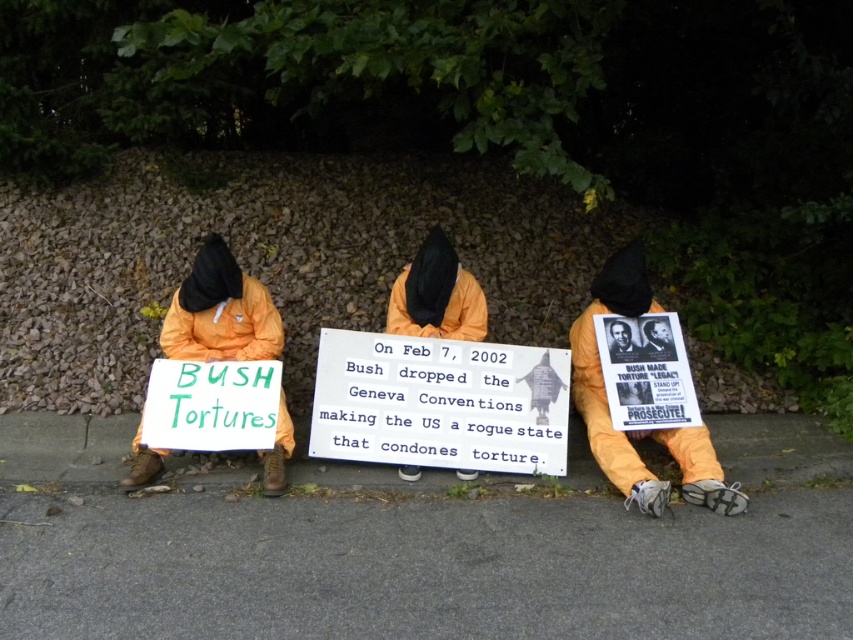
Does orange fabric poster at center have a greater height compared to orange fabric sign at left?

Yes.

Is orange fabric poster at center further to camera compared to orange fabric sign at left?

That is False.

Is point (642, 477) more distant than point (270, 349)?

No, (642, 477) is closer to viewer.

At what (x,y) coordinates should I click in order to perform the action: click on orange fabric poster at center. Please return your answer as a coordinate pair (x, y). Image resolution: width=853 pixels, height=640 pixels. Looking at the image, I should click on pyautogui.click(x=637, y=429).

Which is in front, point (674, 435) or point (459, 298)?

Point (674, 435) is in front.

Who is higher up, orange fabric poster at center or orange fabric hood at center?

Positioned higher is orange fabric hood at center.

Does point (686, 444) come farther from viewer compared to point (450, 320)?

No, (686, 444) is in front of (450, 320).

The image size is (853, 640). Find the location of `orange fabric poster at center`. orange fabric poster at center is located at coordinates (637, 429).

Between orange fabric sign at left and orange fabric hood at center, which one is positioned lower?

orange fabric sign at left is below.

Between orange fabric sign at left and orange fabric hood at center, which one has less height?

With less height is orange fabric hood at center.

Is point (183, 285) positioned in front of point (416, 266)?

That is False.

Where is `orange fabric sign at left`? The width and height of the screenshot is (853, 640). orange fabric sign at left is located at coordinates (219, 310).